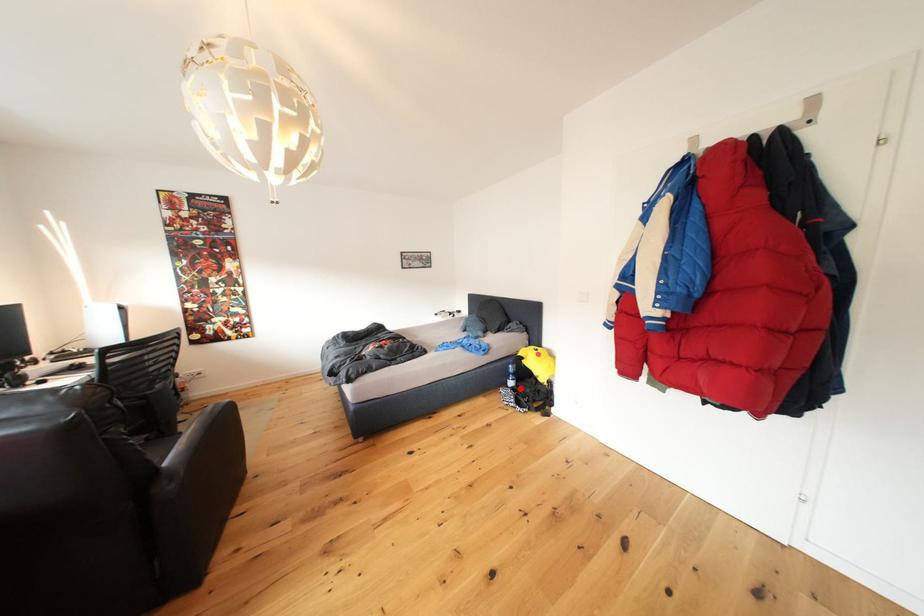
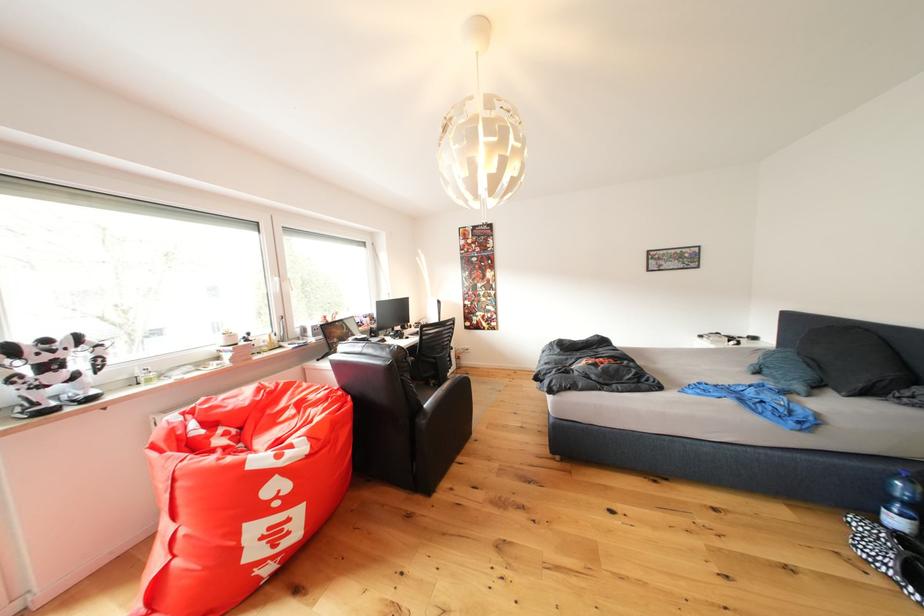
Question: A red point is marked in image1. In image2, is the corresponding 3D point closer to the camera or farther? Reply with the corresponding letter.

Choices:
 (A) The corresponding 3D point is closer.
 (B) The corresponding 3D point is farther.

Answer: (A)